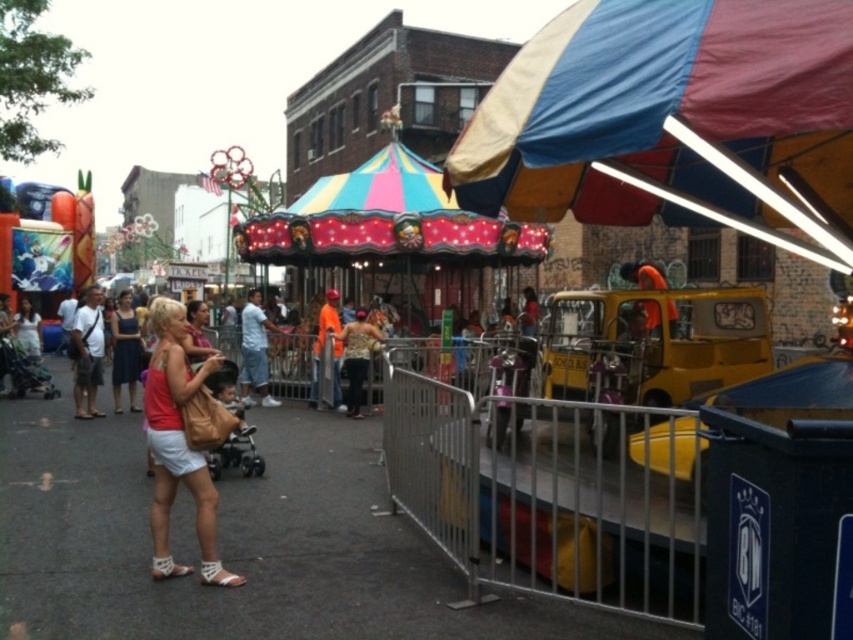
You are standing at the center of the carousel and looking towards the upper right corner of the image. Which object is located at the point with coordinates (666, 115)?

The point at coordinates (666, 115) is located on the multicolored fabric canopy at upper right.

You are standing at the entrance of the carousel and see both the matte pink blouse at center and the matte blue dress at center. Which clothing item is closer to you?

The matte pink blouse at center is closer to you because it is in front of the matte blue dress at center.